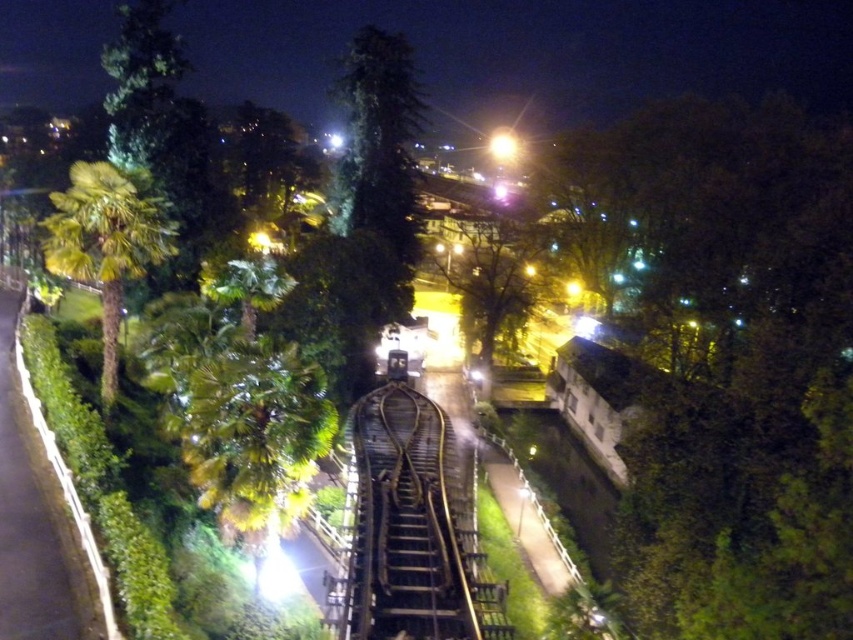
Describe the element at coordinates (407, 525) in the screenshot. Image resolution: width=853 pixels, height=640 pixels. I see `wooden at center` at that location.

Is point (426, 518) positioned after point (77, 246)?

Yes, it is.

Identify the location of wooden at center. The height and width of the screenshot is (640, 853). (407, 525).